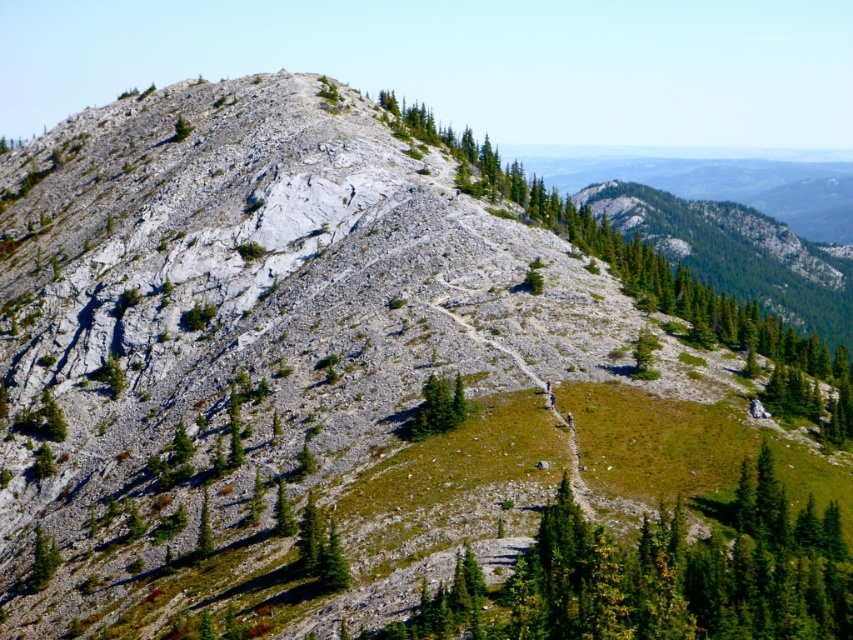
Question: Is green leafy tree at center above green matte tree at center?

Choices:
 (A) no
 (B) yes

Answer: (B)

Question: Does green coniferous tree at center appear on the right side of green matte tree at center?

Choices:
 (A) no
 (B) yes

Answer: (B)

Question: Does green leafy tree at center appear under green matte tree at center?

Choices:
 (A) yes
 (B) no

Answer: (B)

Question: Which point appears closest to the camera in this image?

Choices:
 (A) (560, 224)
 (B) (772, 545)
 (C) (421, 426)

Answer: (B)

Question: Which point is farther to the camera?

Choices:
 (A) (775, 628)
 (B) (480, 163)
 (C) (428, 426)

Answer: (B)

Question: Considering the real-world distances, which object is closest to the green leafy tree at center?

Choices:
 (A) green coniferous tree at center
 (B) green matte tree at center

Answer: (A)